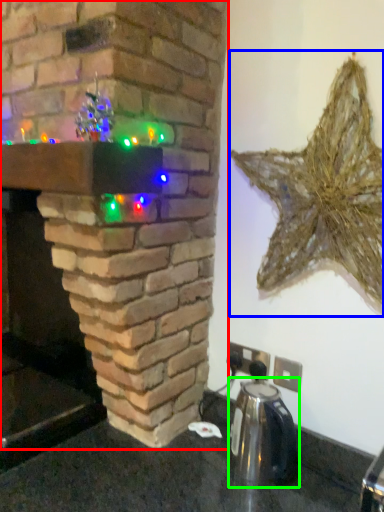
Question: Which object is the farthest from fireplace (highlighted by a red box)? Choose among these: star (highlighted by a blue box) or appliance (highlighted by a green box).

Choices:
 (A) star
 (B) appliance

Answer: (B)